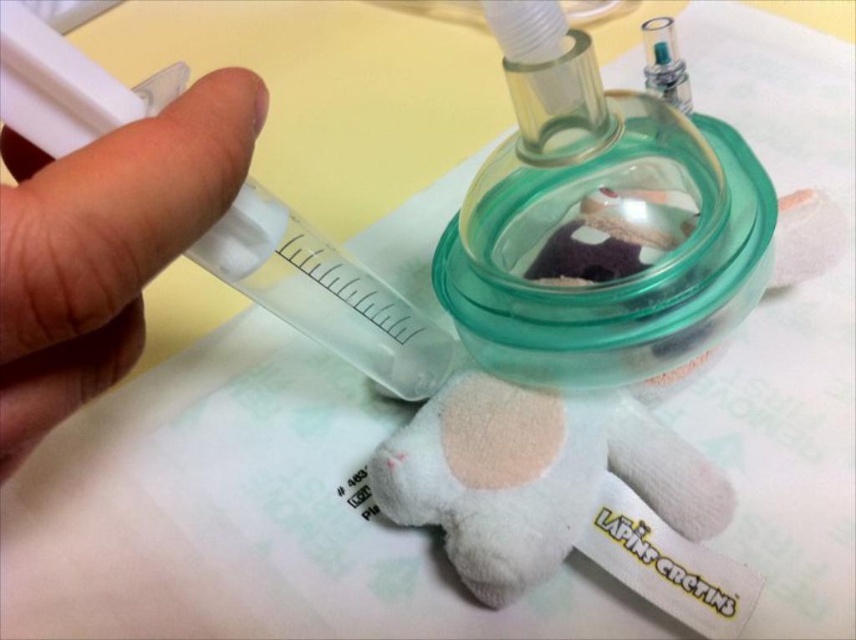
Does white plush toy at center appear on the right side of transparent plastic syringe at upper left?

Correct, you'll find white plush toy at center to the right of transparent plastic syringe at upper left.

Who is more forward, (443, 470) or (331, 257)?

Positioned in front is point (331, 257).

You are a GUI agent. You are given a task and a screenshot of the screen. Output one action in this format:
    pyautogui.click(x=<x>, y=<y>)
    Task: Click on the white plush toy at center
    This screenshot has width=856, height=640.
    Given the screenshot: What is the action you would take?
    pyautogui.click(x=578, y=296)

Does white plush toy at center have a lesser width compared to transparent plastic syringe at left?

In fact, white plush toy at center might be wider than transparent plastic syringe at left.

Can you confirm if white plush toy at center is bigger than transparent plastic syringe at left?

Yes.

Which is behind, point (547, 257) or point (187, 92)?

Point (547, 257)

Locate an element on the screen. The width and height of the screenshot is (856, 640). white plush toy at center is located at coordinates click(x=578, y=296).

Between transparent plastic syringe at left and transparent plastic syringe at upper left, which one is positioned lower?

transparent plastic syringe at left

Is transparent plastic syringe at left wider than transparent plastic syringe at upper left?

Incorrect, transparent plastic syringe at left's width does not surpass transparent plastic syringe at upper left's.

Where is `transparent plastic syringe at left`? transparent plastic syringe at left is located at coordinates (105, 244).

You are a GUI agent. You are given a task and a screenshot of the screen. Output one action in this format:
    pyautogui.click(x=<x>, y=<y>)
    Task: Click on the transparent plastic syringe at left
    
    Given the screenshot: What is the action you would take?
    pyautogui.click(x=105, y=244)